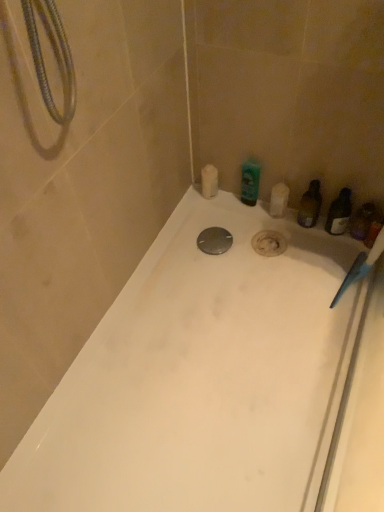
You are a GUI agent. You are given a task and a screenshot of the screen. Output one action in this format:
    pyautogui.click(x=<x>, y=<y>)
    Task: Click on the free space in front of green glossy bottle at upper right, acting as the 3th toiletry starting from the right
    The height and width of the screenshot is (512, 384).
    Given the screenshot: What is the action you would take?
    pyautogui.click(x=251, y=234)